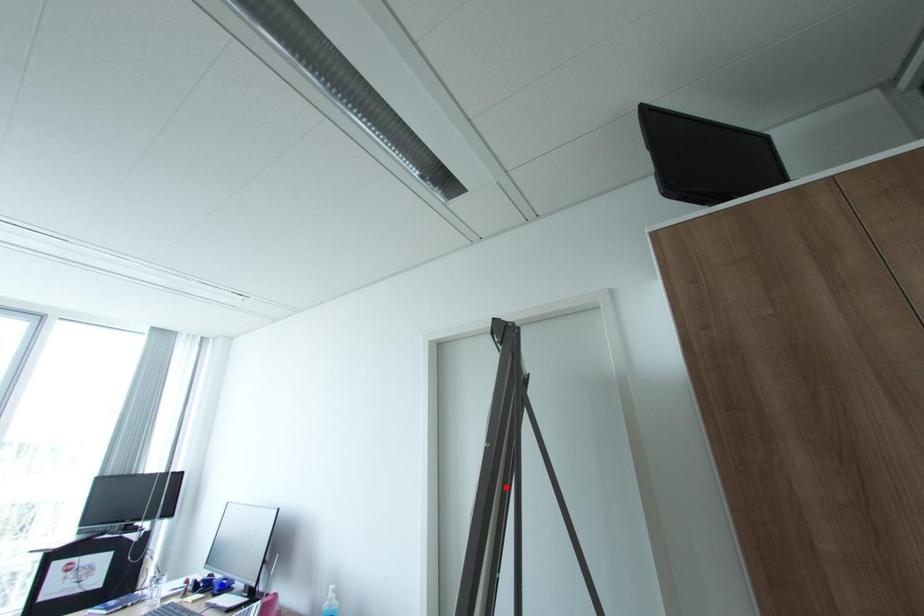
Question: Which of the two points in the image is closer to the camera?

Choices:
 (A) Blue point is closer.
 (B) Red point is closer.

Answer: (B)